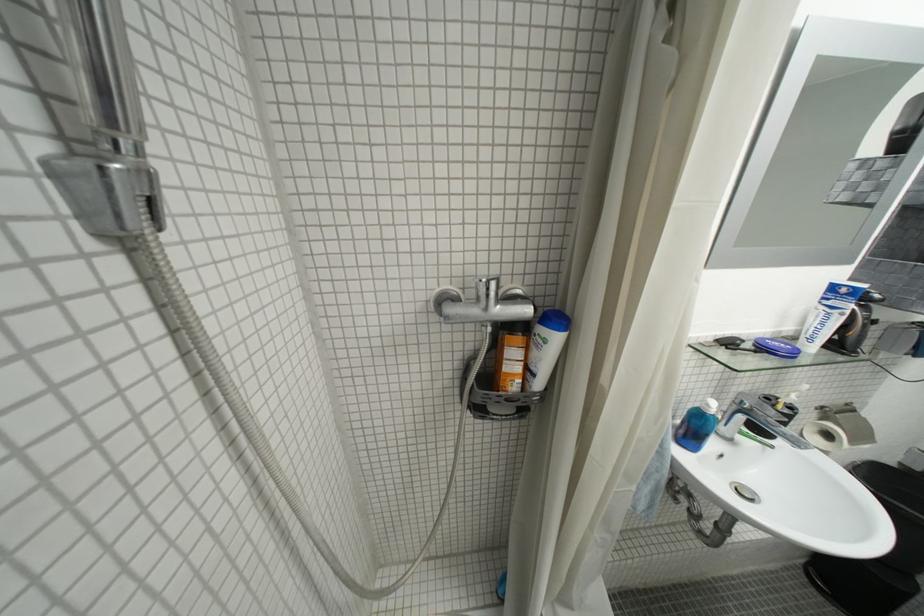
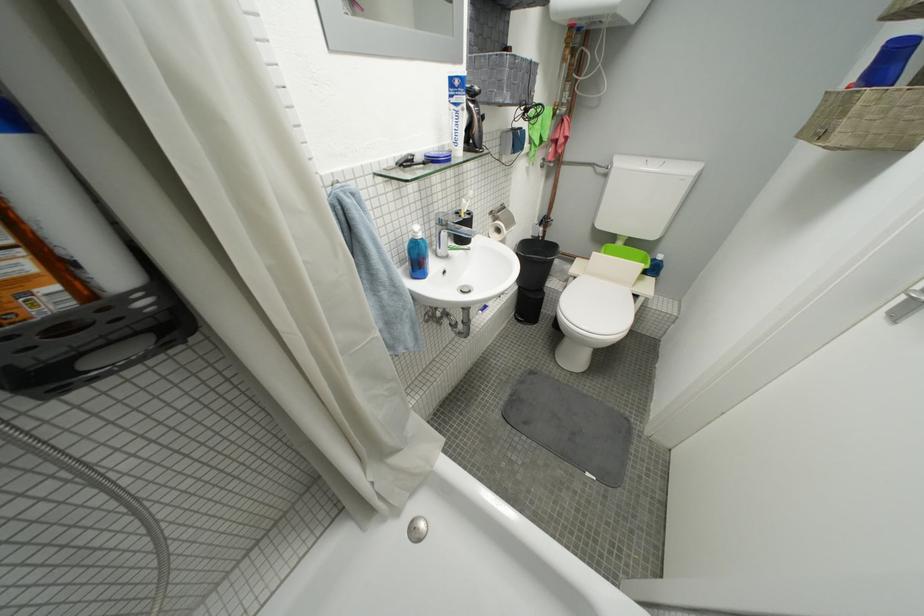
The point at (831, 410) is marked in the first image. Where is the corresponding point in the second image?

(500, 214)